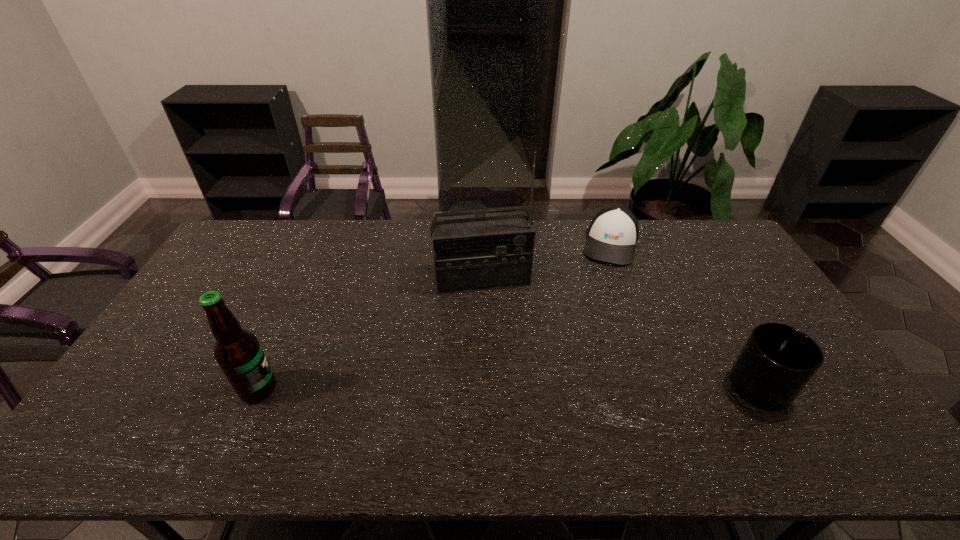
Locate an element on the screen. This screenshot has width=960, height=540. free point located on the front panel of the radio receiver is located at coordinates click(505, 367).

The width and height of the screenshot is (960, 540). In order to click on vacant space situated on the front panel of the radio receiver in this screenshot , I will do `click(507, 373)`.

In order to click on vacant area situated 0.120m on the front panel of the shortest object in this screenshot , I will do `click(603, 288)`.

The height and width of the screenshot is (540, 960). In order to click on free space located on the front panel of the shortest object in this screenshot , I will do `click(592, 336)`.

Identify the location of free space located on the front panel of the shortest object. (590, 347).

Locate an element on the screen. object that is at the far edge is located at coordinates (613, 233).

This screenshot has width=960, height=540. Find the location of `beer bottle positioned at the near edge`. beer bottle positioned at the near edge is located at coordinates (238, 352).

Find the location of a particular element. The width and height of the screenshot is (960, 540). mug present at the near edge is located at coordinates (777, 361).

Image resolution: width=960 pixels, height=540 pixels. Find the location of `object at the right edge`. object at the right edge is located at coordinates (x=777, y=361).

Locate an element on the screen. Image resolution: width=960 pixels, height=540 pixels. object that is at the near right corner is located at coordinates (777, 361).